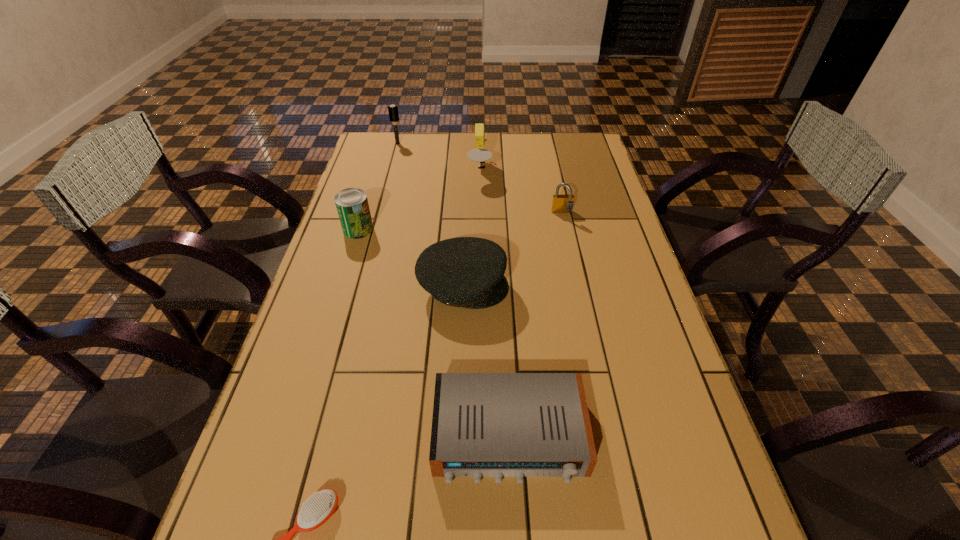
Identify the location of object situated at the far left corner. (393, 112).

This screenshot has height=540, width=960. What are the coordinates of `free space at the far edge of the desktop` in the screenshot? It's located at (439, 133).

I want to click on vacant space at the left edge of the desktop, so click(287, 508).

In the image, there is a desktop. At what (x,y) coordinates should I click in order to perform the action: click on vacant space at the right edge. Please return your answer as a coordinate pair (x, y). Image resolution: width=960 pixels, height=540 pixels. Looking at the image, I should click on (614, 204).

Where is `free space at the far right corner`? free space at the far right corner is located at coordinates click(585, 137).

Where is `blank region between the beret and the rightmost object`? The width and height of the screenshot is (960, 540). blank region between the beret and the rightmost object is located at coordinates (x=513, y=250).

In order to click on vacant point located between the sponge and the padlock in this screenshot , I will do `click(521, 191)`.

Find the location of `free area in between the fifth nearest object and the radio receiver`. free area in between the fifth nearest object and the radio receiver is located at coordinates (536, 324).

The width and height of the screenshot is (960, 540). In order to click on free space that is in between the second farthest object and the beret in this screenshot , I will do `click(471, 228)`.

Image resolution: width=960 pixels, height=540 pixels. I want to click on vacant area between the padlock and the fifth farthest object, so click(513, 250).